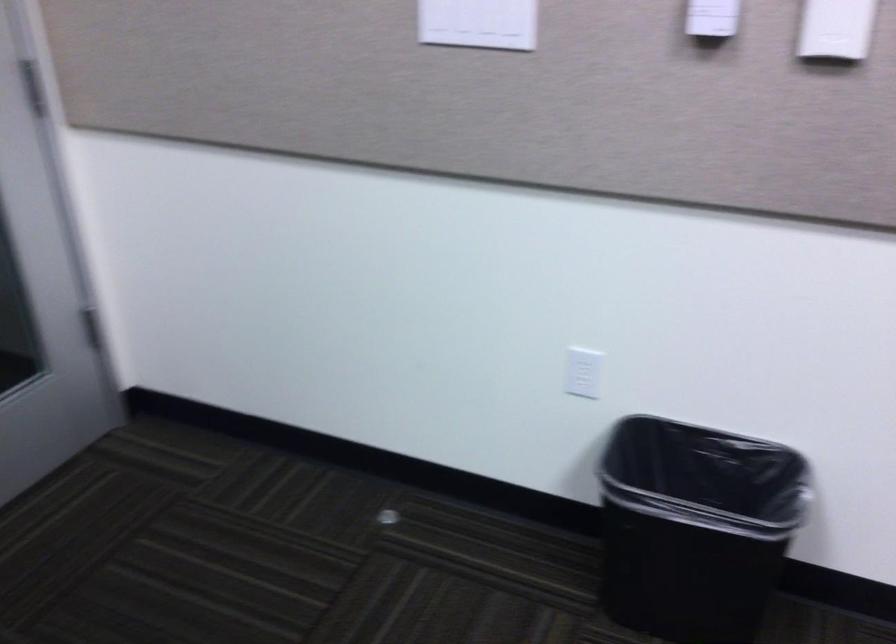
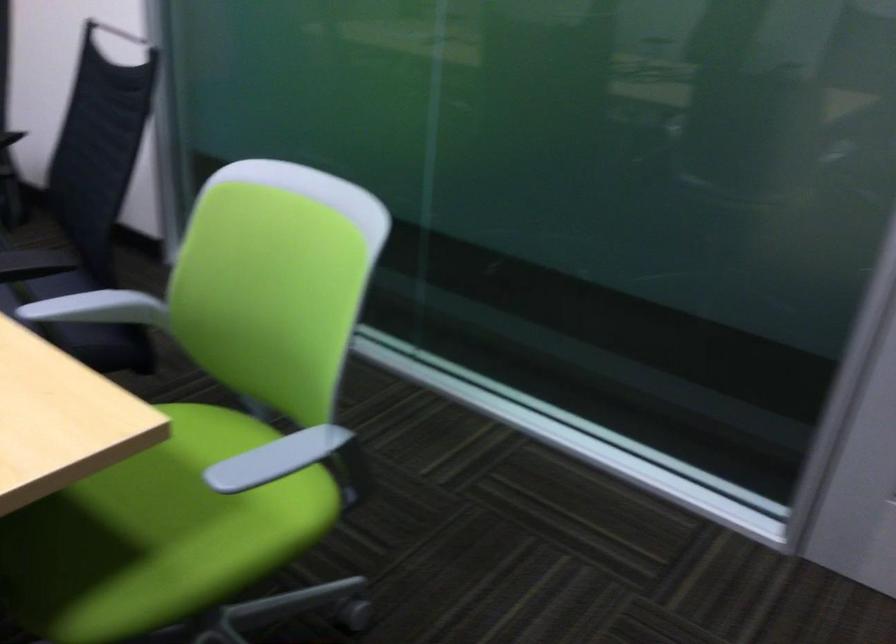
The first image is from the beginning of the video and the second image is from the end. How did the camera likely rotate when shooting the video?

The camera rotated toward left-down.